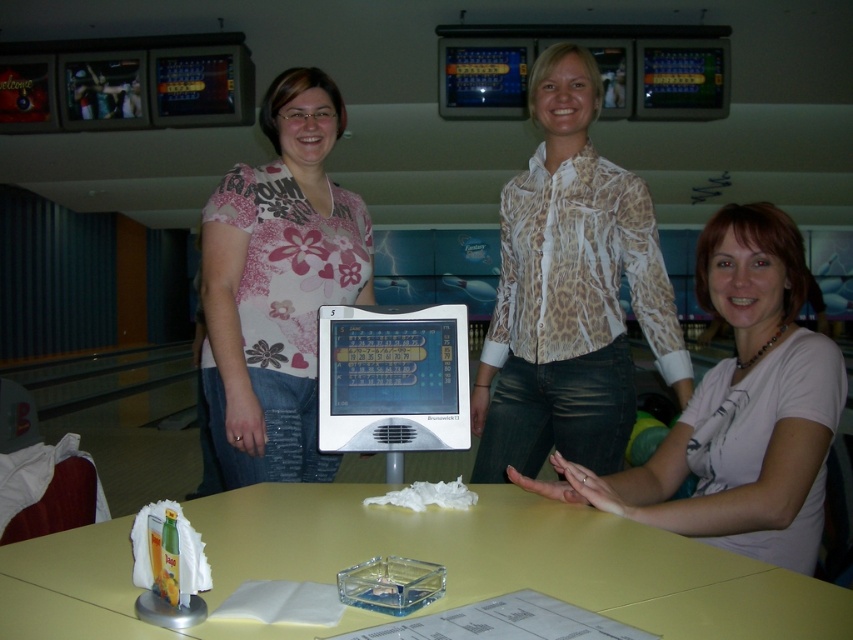
Is leopard print blouse at center further to camera compared to white matte shirt at center?

That is True.

Is leopard print blouse at center shorter than white matte shirt at center?

No, leopard print blouse at center is not shorter than white matte shirt at center.

Which is in front, point (630, 269) or point (788, 262)?

Point (788, 262)

You are a GUI agent. You are given a task and a screenshot of the screen. Output one action in this format:
    pyautogui.click(x=<x>, y=<y>)
    Task: Click on the leopard print blouse at center
    This screenshot has width=853, height=640.
    Given the screenshot: What is the action you would take?
    pyautogui.click(x=570, y=292)

Can you confirm if yellow matte table at center is thinner than leopard print blouse at center?

Incorrect, yellow matte table at center's width is not less than leopard print blouse at center's.

Is yellow matte table at center to the left of leopard print blouse at center from the viewer's perspective?

Yes, yellow matte table at center is to the left of leopard print blouse at center.

This screenshot has height=640, width=853. Describe the element at coordinates (517, 557) in the screenshot. I see `yellow matte table at center` at that location.

Locate an element on the screen. The image size is (853, 640). yellow matte table at center is located at coordinates (517, 557).

Who is shorter, white matte shirt at center or pink floral shirt at center?

With less height is white matte shirt at center.

Which is below, white matte shirt at center or pink floral shirt at center?

white matte shirt at center is below.

Is point (734, 406) more distant than point (357, 280)?

No, it is not.

The width and height of the screenshot is (853, 640). I want to click on white matte shirt at center, so click(740, 410).